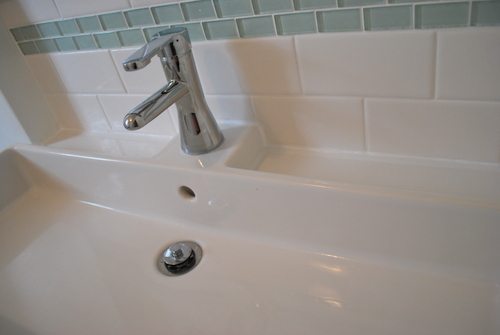
The image size is (500, 335). What are the coordinates of `overflow hole` in the screenshot? It's located at click(188, 187), click(186, 200), click(181, 191), click(192, 195).